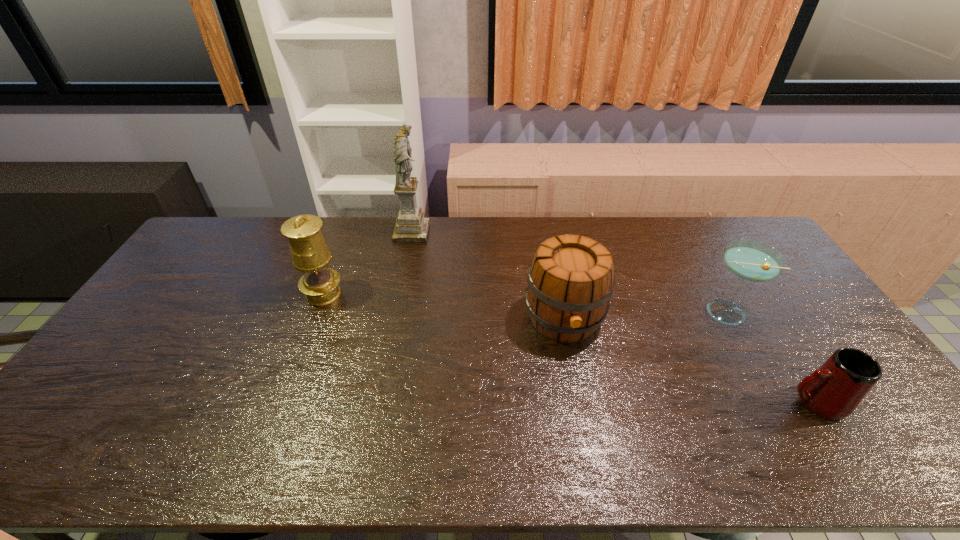
You are a GUI agent. You are given a task and a screenshot of the screen. Output one action in this format:
    pyautogui.click(x=<x>, y=<y>)
    Task: Click on the free space between the nearest object and the oil lamp
    
    Given the screenshot: What is the action you would take?
    pyautogui.click(x=569, y=348)

I want to click on empty space that is in between the shortest object and the second object from left to right, so click(x=613, y=318).

Identify the location of vacant area that lies between the martini and the mug. This screenshot has width=960, height=540. (769, 357).

Locate an element on the screen. free space between the martini and the mug is located at coordinates (769, 357).

Locate an element on the screen. Image resolution: width=960 pixels, height=540 pixels. free point between the mug and the martini is located at coordinates (769, 357).

Where is `empty space that is in between the mug and the tallest object`? This screenshot has height=540, width=960. empty space that is in between the mug and the tallest object is located at coordinates (613, 318).

You are a GUI agent. You are given a task and a screenshot of the screen. Output one action in this format:
    pyautogui.click(x=<x>, y=<y>)
    Task: Click on the unoccupied area between the cider and the farthest object
    This screenshot has height=540, width=960.
    Given the screenshot: What is the action you would take?
    pyautogui.click(x=488, y=275)

This screenshot has width=960, height=540. I want to click on vacant area that lies between the nearest object and the second object from left to right, so click(613, 318).

Identify the location of vacant area that lies between the fourth object from right to left and the mug. (613, 318).

Identify which object is the closest to the second object from left to right. Please provide its 2D coordinates. Your answer should be formatted as a tuple, i.e. [(x, y)], where the tuple contains the x and y coordinates of a point satisfying the conditions above.

[(310, 254)]